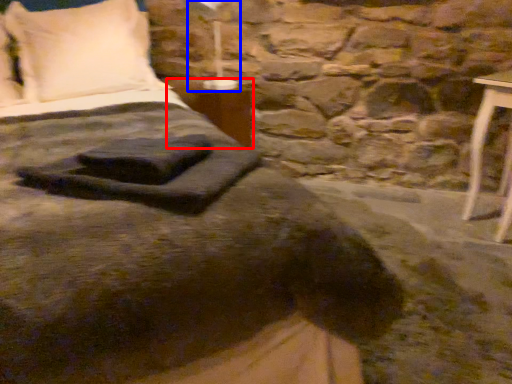
Question: Which of the following is the closest to the observer, table (highlighted by a red box) or bedside lamp (highlighted by a blue box)?

Choices:
 (A) table
 (B) bedside lamp

Answer: (B)